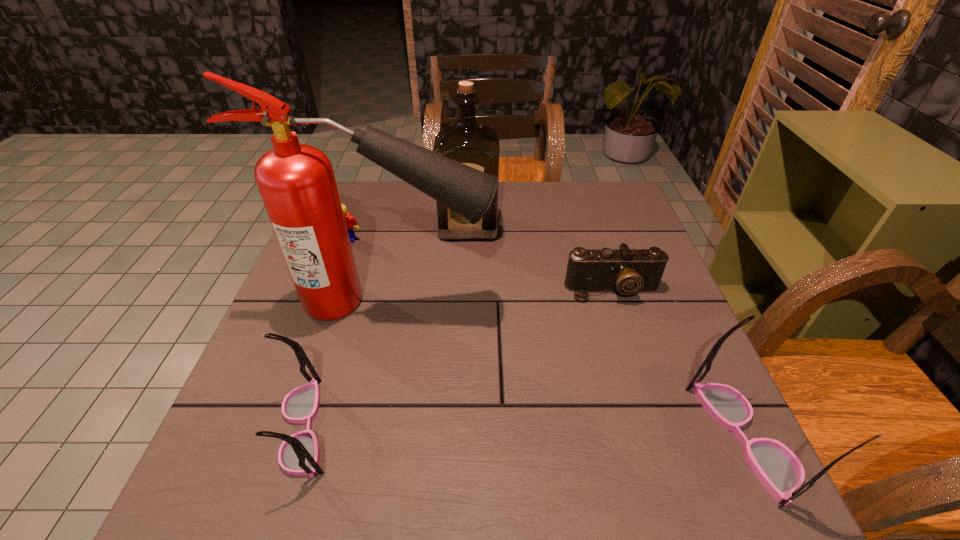
Locate an element on the screen. The image size is (960, 540). free space that satisfies the following two spatial constraints: 1. on the back side of the right spectacles; 2. at the nozzle of the tallest object is located at coordinates (680, 301).

Where is `free space that satisfies the following two spatial constraints: 1. on the label of the liquor; 2. at the nozzle of the tallest object`? free space that satisfies the following two spatial constraints: 1. on the label of the liquor; 2. at the nozzle of the tallest object is located at coordinates (467, 301).

At what (x,y) coordinates should I click in order to perform the action: click on free point that satisfies the following two spatial constraints: 1. at the nozzle of the fire extinguisher; 2. on the front side of the left spectacles. Please return your answer as a coordinate pair (x, y). Looking at the image, I should click on (361, 428).

At what (x,y) coordinates should I click in order to perform the action: click on vacant space that satisfies the following two spatial constraints: 1. on the front-facing side of the Lego; 2. on the right side of the left spectacles. Please return your answer as a coordinate pair (x, y). Looking at the image, I should click on (279, 428).

What are the coordinates of `free space that satisfies the following two spatial constraints: 1. on the front-facing side of the camera; 2. at the nozzle of the fire extinguisher` in the screenshot? It's located at (616, 301).

The width and height of the screenshot is (960, 540). In order to click on blank area in the image that satisfies the following two spatial constraints: 1. on the front-facing side of the Lego; 2. on the left side of the left spectacles in this screenshot , I will do `click(279, 428)`.

Find the location of a particular element. The image size is (960, 540). vacant space that satisfies the following two spatial constraints: 1. on the front-facing side of the Lego; 2. on the right side of the shorter spectacles is located at coordinates (279, 428).

Where is `vacant space that satisfies the following two spatial constraints: 1. at the nozzle of the fire extinguisher; 2. on the left side of the taller spectacles`? This screenshot has width=960, height=540. vacant space that satisfies the following two spatial constraints: 1. at the nozzle of the fire extinguisher; 2. on the left side of the taller spectacles is located at coordinates (358, 438).